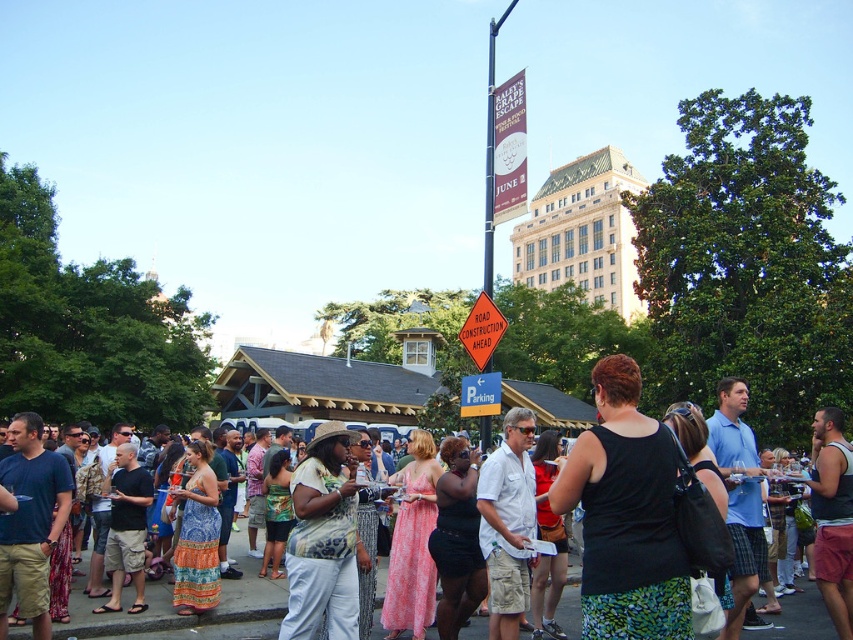
Question: Can you confirm if orange diamond-shaped road construction sign at center is positioned to the left of yellow plastic parking sign at center?

Choices:
 (A) yes
 (B) no

Answer: (B)

Question: Which point is farther to the camera?

Choices:
 (A) yellow plastic parking sign at center
 (B) matte black dress at center

Answer: (A)

Question: Can you confirm if matte black dress at center is positioned below yellow plastic parking sign at center?

Choices:
 (A) no
 (B) yes

Answer: (B)

Question: Which object is the closest to the yellow plastic parking sign at center?

Choices:
 (A) matte black dress at center
 (B) orange diamond-shaped road construction sign at center

Answer: (B)

Question: Which is farther from the yellow plastic parking sign at center?

Choices:
 (A) orange diamond-shaped road construction sign at center
 (B) matte black dress at center

Answer: (B)

Question: Is orange diamond-shaped road construction sign at center in front of yellow plastic parking sign at center?

Choices:
 (A) no
 (B) yes

Answer: (B)